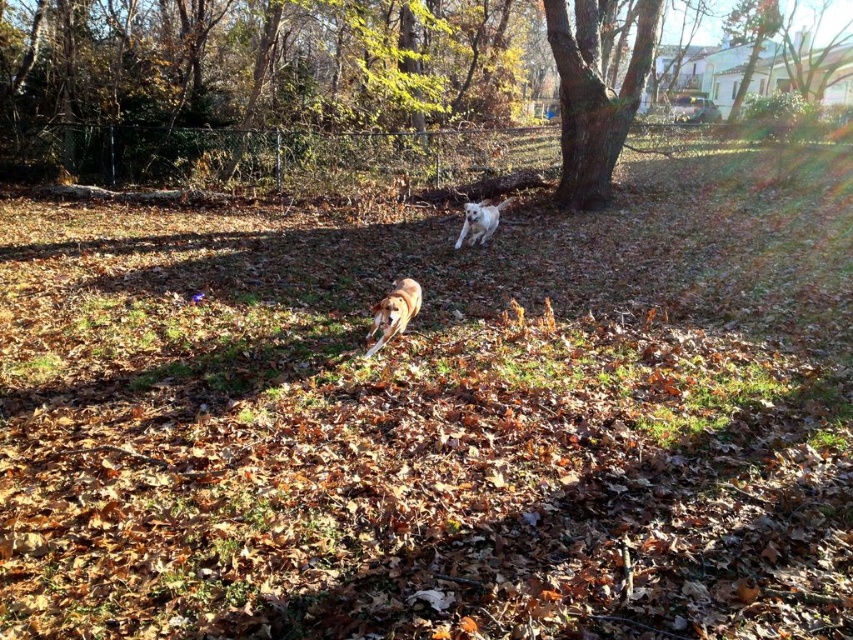
Looking at this image, you are standing in the autumn scene and want to take a photo of the white fluffy dog at center and the brown textured tree at center. If you want the tree to appear to the right of the dog in your photo, should you position yourself to the left or the right of the dog?

You should position yourself to the left of the white fluffy dog at center. Since the brown textured tree at center is already to the right of the white fluffy dog at center, standing to the left of the dog will keep the tree positioned to the right in the photo.

You are a hiker standing at the edge of the grassy area in the scene. You want to throw a ball to your dog, the brown furry dog at center, but there is a brown textured tree at center in the way. Can you throw the ball to the dog without the ball hitting the tree?

The distance between the brown textured tree at center and the brown furry dog at center is 15.71 meters. Since the tree is between you and the dog, you would need to throw the ball around the tree or find a clear path to avoid hitting it. However, the exact positioning isn

You are standing in the autumn scene and see the brown furry dog at center and the white fluffy dog at center. Which dog is positioned to the left when facing towards the camera?

The brown furry dog at center is positioned to the left of the white fluffy dog at center when facing towards the camera.